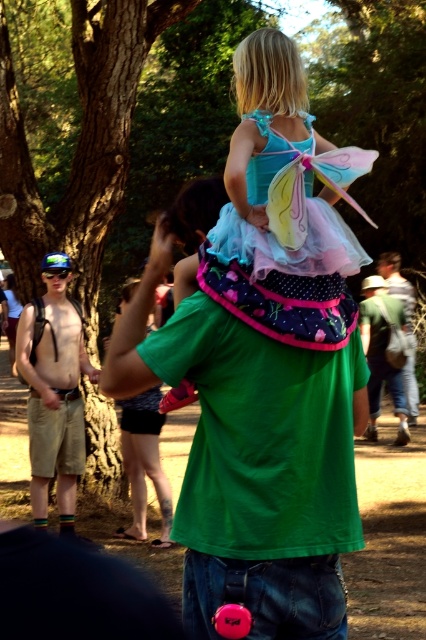
You are at a park and see the shiny metallic shirt at left and the denim jeans at lower right. Which one is positioned more to the left side?

The shiny metallic shirt at left is positioned more to the left side than the denim jeans at lower right.

You are a tailor who needs to know the clothing dimensions for alterations. Given the scene, which clothing item has a smaller width between the green cotton shirt at center and the skinny jeans at lower center?

The green cotton shirt at center has a smaller width than the skinny jeans at lower center according to the description.